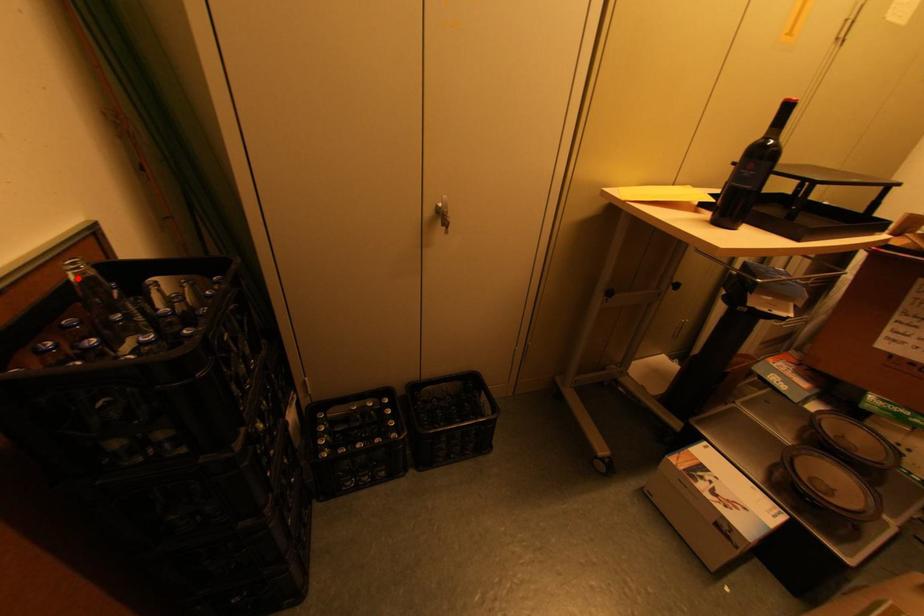
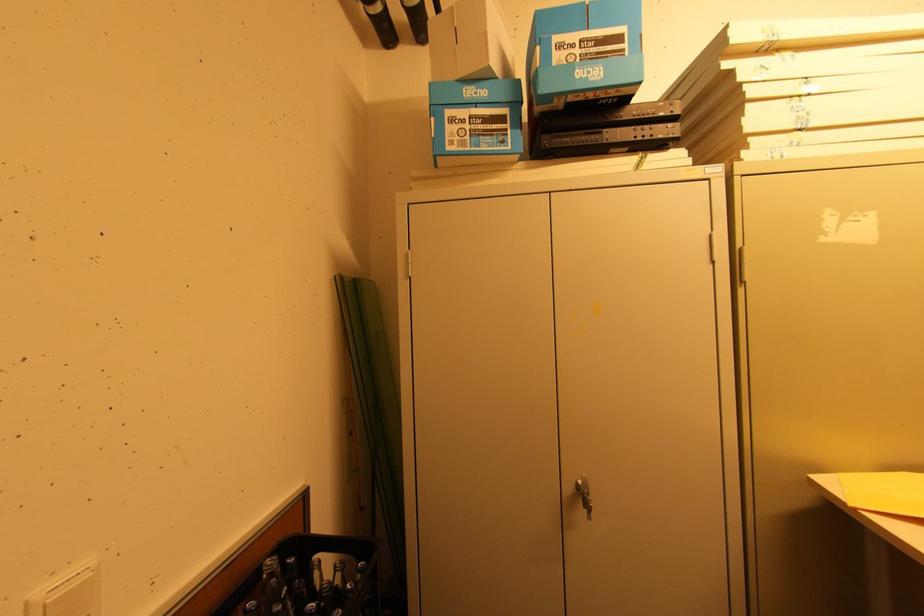
In the second image, find the point that corresponds to the highlighted location in the first image.

(268, 578)